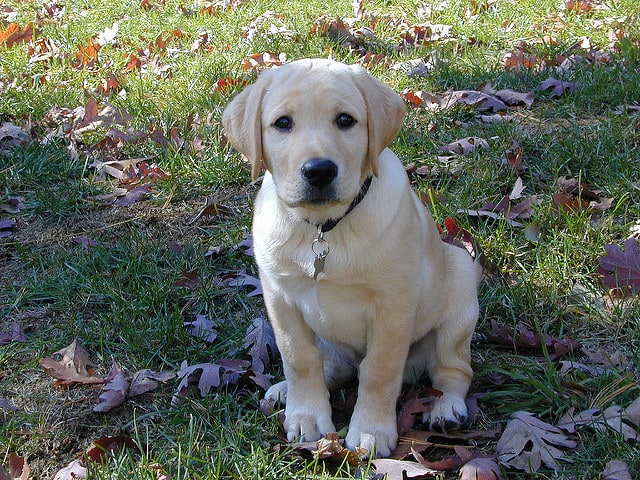
This screenshot has height=480, width=640. Find the location of `white fur`. white fur is located at coordinates (394, 176).